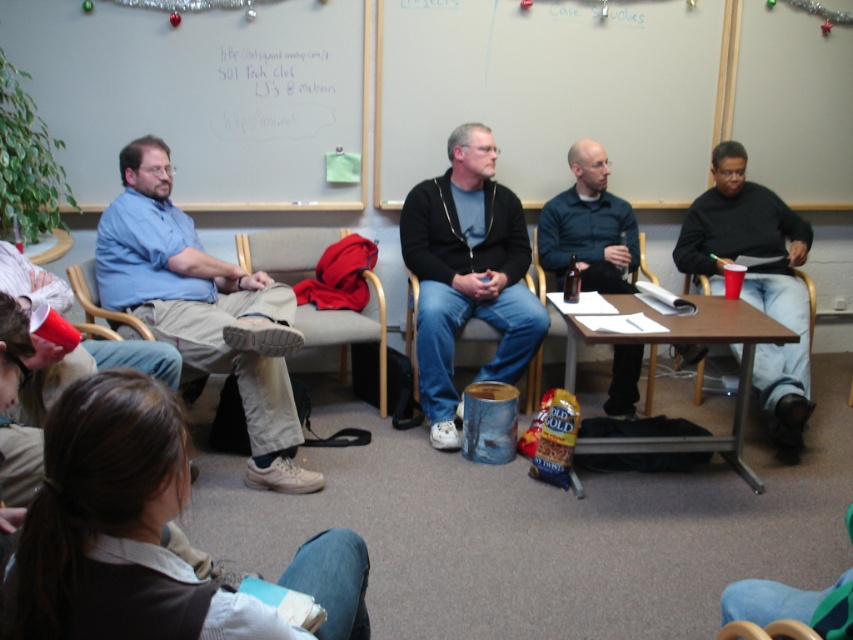
Does black sweater at right have a greater width compared to wooden armchair at lower right?

Correct, the width of black sweater at right exceeds that of wooden armchair at lower right.

Locate an element on the screen. Image resolution: width=853 pixels, height=640 pixels. black sweater at right is located at coordinates (756, 278).

This screenshot has width=853, height=640. What are the coordinates of `black sweater at right` in the screenshot? It's located at (756, 278).

What do you see at coordinates (202, 308) in the screenshot? I see `light blue shirt at left` at bounding box center [202, 308].

Between light blue shirt at left and red fabric armchair at center, which one is positioned higher?

light blue shirt at left is above.

Where is `light blue shirt at left`? This screenshot has width=853, height=640. light blue shirt at left is located at coordinates (202, 308).

Is point (263, 360) less distant than point (612, 301)?

Yes, point (263, 360) is in front of point (612, 301).

Between point (248, 323) and point (732, 321), which one is positioned in front?

Point (248, 323) is more forward.

This screenshot has height=640, width=853. Identify the location of light blue shirt at left. (202, 308).